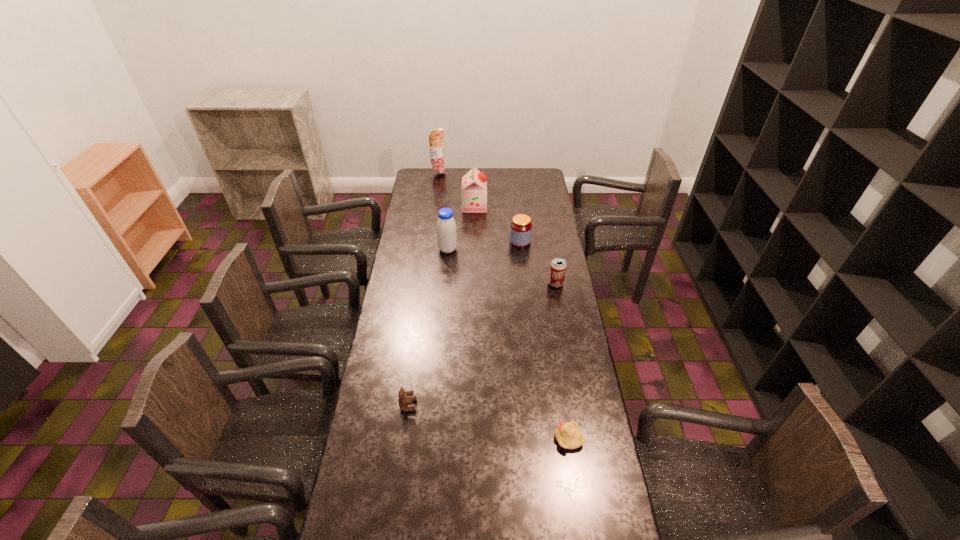
The height and width of the screenshot is (540, 960). I want to click on the nearest object, so click(568, 436).

Where is `free space located 0.110m on the front of the burrito`? free space located 0.110m on the front of the burrito is located at coordinates (437, 186).

Identify the location of free space located 0.380m on the front of the nearer soya milk. The height and width of the screenshot is (540, 960). (443, 316).

Locate an element on the screen. The height and width of the screenshot is (540, 960). vacant space positioned with the cap open on the farther soya milk is located at coordinates (518, 205).

Locate an element on the screen. free space located 0.250m on the front of the jar is located at coordinates (525, 284).

This screenshot has height=540, width=960. I want to click on vacant space situated 0.160m on the front of the beer can, so click(x=562, y=316).

The image size is (960, 540). Find the location of `free space located on the face of the sixth farthest object`. free space located on the face of the sixth farthest object is located at coordinates (522, 405).

You are a GUI agent. You are given a task and a screenshot of the screen. Output one action in this format:
    pyautogui.click(x=<x>, y=<y>)
    Task: Click on the free space located on the beak of the duckling
    The height and width of the screenshot is (540, 960).
    Given the screenshot: What is the action you would take?
    pyautogui.click(x=489, y=439)

This screenshot has width=960, height=540. Find the location of `free space located on the beak of the duckling`. free space located on the beak of the duckling is located at coordinates (439, 439).

Locate an element on the screen. blank space located 0.100m on the beak of the duckling is located at coordinates (523, 439).